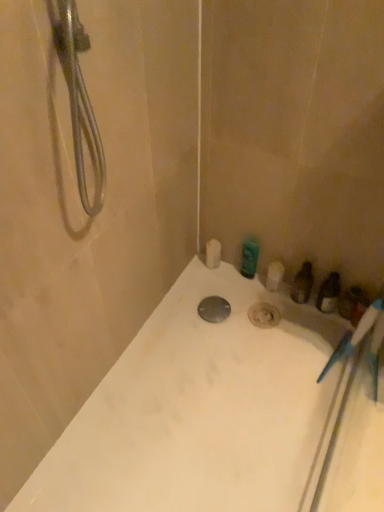
Question: Is white glossy bathtub at center thinner than green glossy bottle at upper right, placed as the 1th toiletry when sorted from top to bottom?

Choices:
 (A) yes
 (B) no

Answer: (B)

Question: From a real-world perspective, is white glossy bathtub at center physically above green glossy bottle at upper right, the second toiletry viewed from the right?

Choices:
 (A) no
 (B) yes

Answer: (A)

Question: Does white glossy bathtub at center touch green glossy bottle at upper right, which is counted as the 1th toiletry, starting from the left?

Choices:
 (A) no
 (B) yes

Answer: (A)

Question: Is white glossy bathtub at center to the right of green glossy bottle at upper right, placed as the 1th toiletry when sorted from top to bottom, from the viewer's perspective?

Choices:
 (A) yes
 (B) no

Answer: (B)

Question: Could green glossy bottle at upper right, placed as the 1th toiletry when sorted from top to bottom, be considered to be inside white glossy bathtub at center?

Choices:
 (A) yes
 (B) no

Answer: (B)

Question: From the image's perspective, relative to white glossy bathtub at center, is metallic silver drain at center above or below?

Choices:
 (A) above
 (B) below

Answer: (A)

Question: From a real-world perspective, is metallic silver drain at center above or below white glossy bathtub at center?

Choices:
 (A) above
 (B) below

Answer: (B)

Question: Is metallic silver drain at center wider or thinner than white glossy bathtub at center?

Choices:
 (A) wide
 (B) thin

Answer: (B)

Question: Choose the correct answer: Is metallic silver drain at center inside white glossy bathtub at center or outside it?

Choices:
 (A) inside
 (B) outside

Answer: (A)

Question: Considering their positions, is white matte toilet paper at upper center located in front of or behind metallic silver drain at center?

Choices:
 (A) behind
 (B) front

Answer: (A)

Question: Choose the correct answer: Is white matte toilet paper at upper center inside metallic silver drain at center or outside it?

Choices:
 (A) inside
 (B) outside

Answer: (B)

Question: From the image's perspective, is white matte toilet paper at upper center above or below metallic silver drain at center?

Choices:
 (A) below
 (B) above

Answer: (B)

Question: Is white matte toilet paper at upper center to the left or to the right of metallic silver drain at center in the image?

Choices:
 (A) left
 (B) right

Answer: (A)

Question: Does point pyautogui.click(x=208, y=375) appear closer or farther from the camera than point pyautogui.click(x=344, y=294)?

Choices:
 (A) closer
 (B) farther

Answer: (A)

Question: Considering the relative positions of white glossy bathtub at center and translucent plastic bottle at right, the second toiletry when ordered from top to bottom, in the image provided, is white glossy bathtub at center to the left or to the right of translucent plastic bottle at right, the second toiletry when ordered from top to bottom,?

Choices:
 (A) right
 (B) left

Answer: (B)